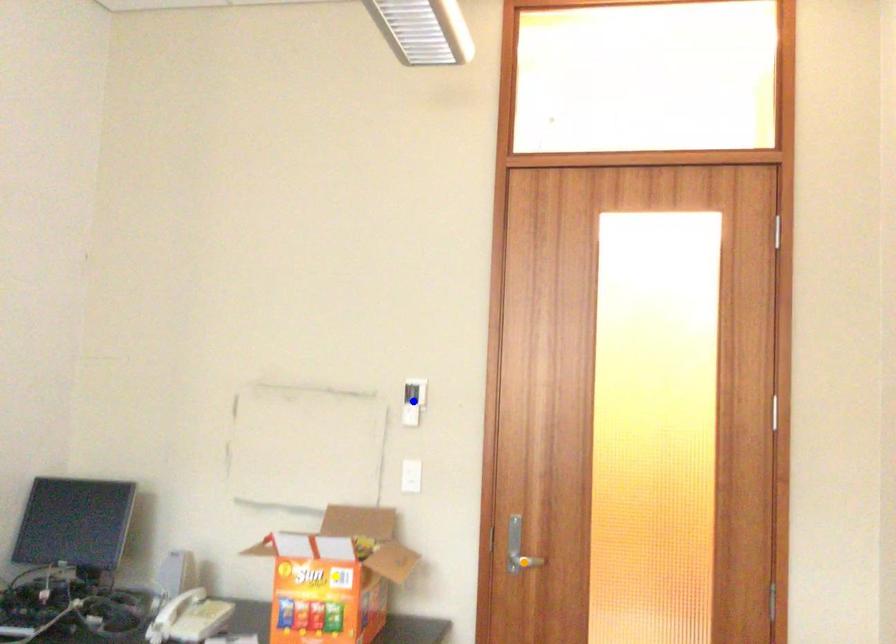
Order these from nearest to farthest:
1. orange point
2. blue point
3. yellow point

yellow point → orange point → blue point